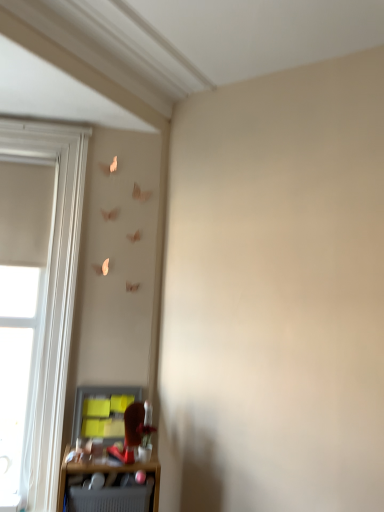
Question: Is point (137, 394) closer or farther from the camera than point (74, 212)?

Choices:
 (A) farther
 (B) closer

Answer: (B)

Question: Visually, is matte gray cabinet at lower left positioned to the left or to the right of white wood window at left?

Choices:
 (A) left
 (B) right

Answer: (B)

Question: Based on their relative distances, which object is farther from the matte gray cabinet at lower left?

Choices:
 (A) matte gray shelf at lower left
 (B) white wood window at left

Answer: (B)

Question: Estimate the real-world distances between objects in this image. Which object is farther from the white wood window at left?

Choices:
 (A) matte gray shelf at lower left
 (B) matte gray cabinet at lower left

Answer: (A)